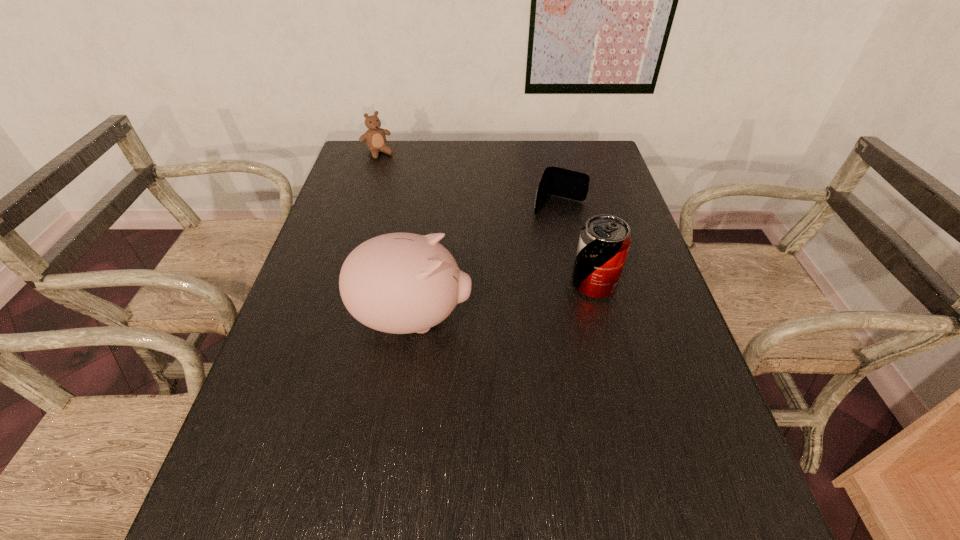
This screenshot has height=540, width=960. In order to click on free region located on the front-facing side of the leftmost object in this screenshot , I will do `click(407, 187)`.

Where is `blank space located on the front-facing side of the leftmost object`? This screenshot has height=540, width=960. blank space located on the front-facing side of the leftmost object is located at coordinates (400, 178).

The width and height of the screenshot is (960, 540). Identify the location of free space located on the outer surface of the shortest object. (529, 273).

Locate an element on the screen. vacant area situated 0.090m on the outer surface of the shortest object is located at coordinates (544, 235).

This screenshot has height=540, width=960. Identify the location of vacant space located on the outer surface of the shortest object. (536, 259).

I want to click on object positioned at the far edge, so click(x=375, y=139).

Where is `piggy bank situated at the left edge`? The height and width of the screenshot is (540, 960). piggy bank situated at the left edge is located at coordinates (400, 283).

At what (x,y) coordinates should I click in order to perform the action: click on teddy bear that is positioned at the left edge. Please return your answer as a coordinate pair (x, y). This screenshot has width=960, height=540. Looking at the image, I should click on (375, 139).

This screenshot has height=540, width=960. I want to click on soda can located in the right edge section of the desktop, so click(604, 242).

This screenshot has width=960, height=540. In order to click on wallet at the right edge in this screenshot , I will do click(556, 181).